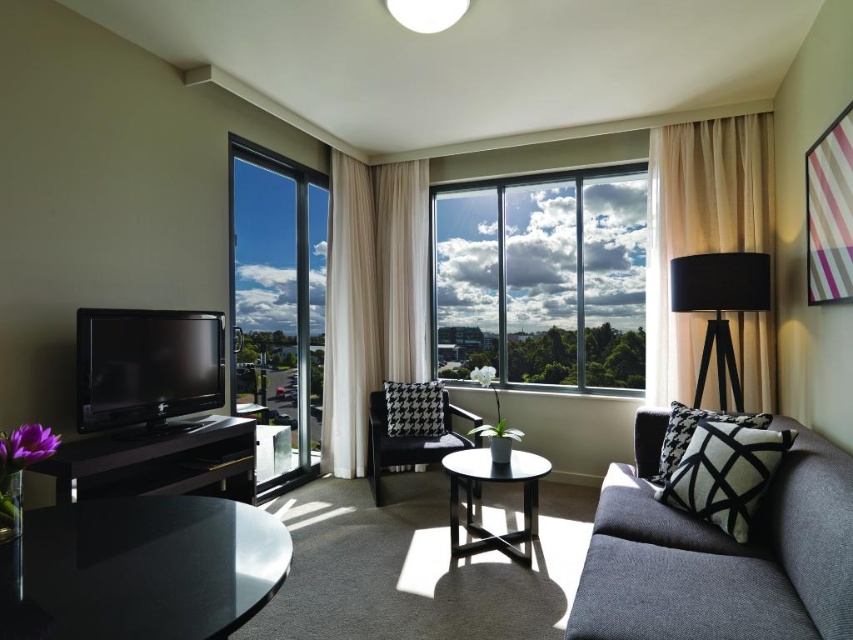
You are standing in the living room and want to take a photo of both the point at coordinates point (270,412) and point (711,161). Which point should you focus on first to ensure both are in focus?

You should focus on point (270,412) first because it is closer to the camera than point (711,161), ensuring both points are within the depth of field.

You are standing in the living room and want to place a 6 feet long decorative shelf between the clear glass window at center and the transparent glass window at left. Can you fit it there?

The distance between the clear glass window at center and the transparent glass window at left is 5.42 feet, which is shorter than the 6 feet long shelf. Therefore, the shelf cannot be placed between them.

You are standing at the entrance of the living room and want to move towards the dark gray fabric couch at right. Based on its position coordinates, can you estimate how far it is from the entrance?

The dark gray fabric couch at right is positioned at coordinates point (720, 554), which suggests it is relatively far from the entrance, likely near the back wall of the living room.